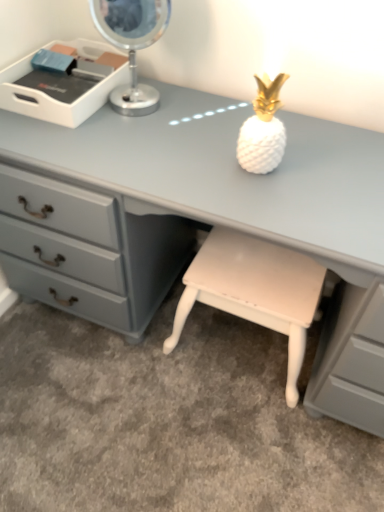
This screenshot has height=512, width=384. I want to click on vacant space in front of matte gray desk at center, so click(x=182, y=443).